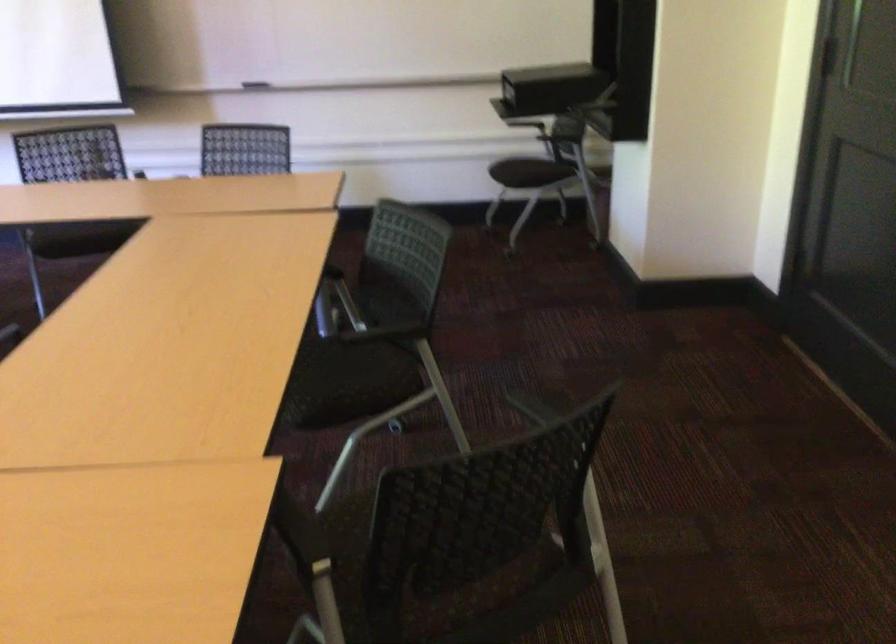
Where is `black document camera`? This screenshot has height=644, width=896. black document camera is located at coordinates (549, 88).